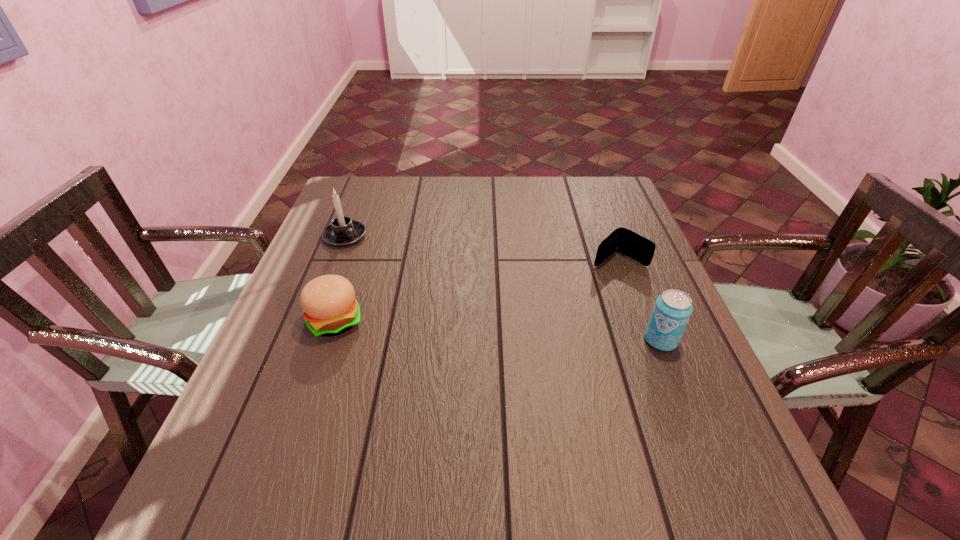
Identify the location of hamburger. This screenshot has height=540, width=960. (330, 308).

Where is `beer can`? beer can is located at coordinates point(672,310).

This screenshot has height=540, width=960. What are the coordinates of `the farthest object` in the screenshot? It's located at click(x=343, y=231).

This screenshot has width=960, height=540. What are the coordinates of `candle holder` in the screenshot? It's located at (343, 231).

Find the location of `the shortest object`. the shortest object is located at coordinates (622, 240).

The height and width of the screenshot is (540, 960). I want to click on the third nearest object, so click(622, 240).

Where is `free point located on the back of the second shortest object`? free point located on the back of the second shortest object is located at coordinates (363, 240).

Locate an element on the screen. vacant region located on the left of the beer can is located at coordinates (617, 340).

Find the location of a particular element. Image resolution: width=960 pixels, height=540 pixels. blank area located with a handle on the side of the tallest object is located at coordinates (412, 289).

Find the location of `vacant space located with a handle on the side of the tallest object`. vacant space located with a handle on the side of the tallest object is located at coordinates (446, 317).